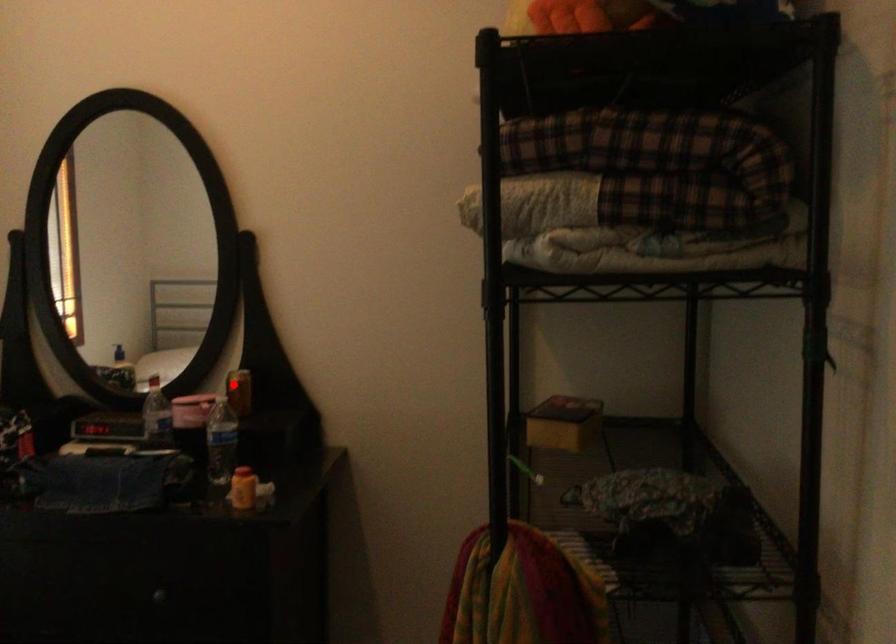
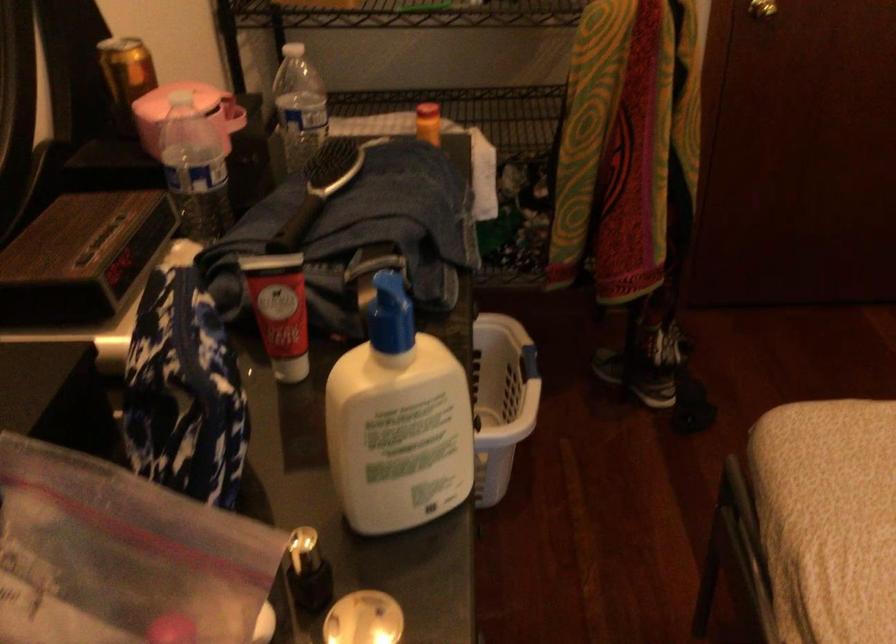
Locate, in the second image, the point that corresponds to the highlighted location in the first image.

(125, 76)